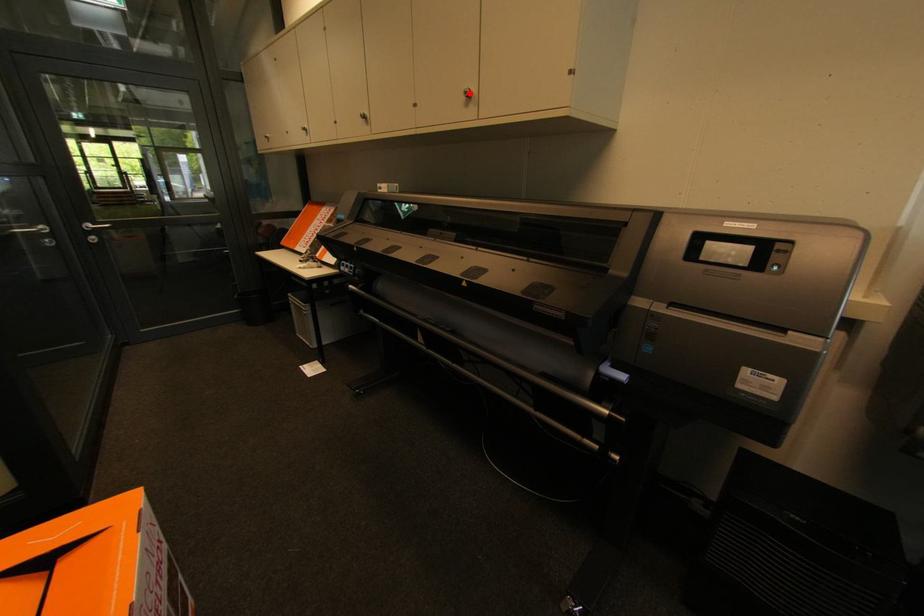
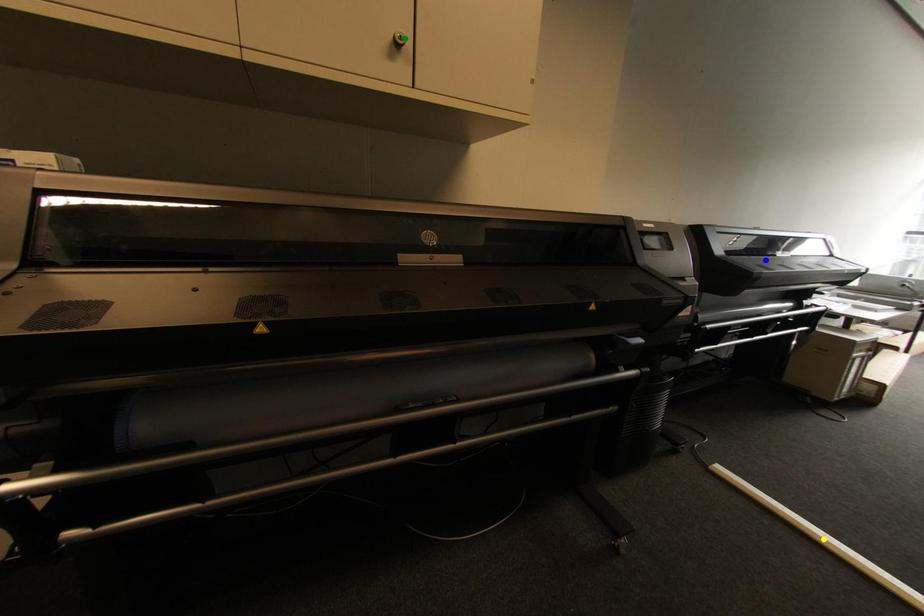
Question: I am providing you with two images of the same scene from different viewpoints. A red point is marked on the first image. You are given multiple points on the second image. Which spot in image 2 lines up with the point in image 1?

Choices:
 (A) yellow point
 (B) green point
 (C) blue point

Answer: (B)